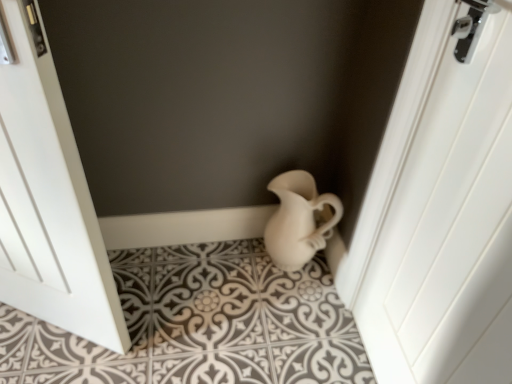
This screenshot has height=384, width=512. What do you see at coordinates (201, 324) in the screenshot?
I see `matte white pitcher at center` at bounding box center [201, 324].

Find the location of a particular element. The image size is (512, 384). matte white pitcher at center is located at coordinates (201, 324).

I want to click on matte white pitcher at center, so click(201, 324).